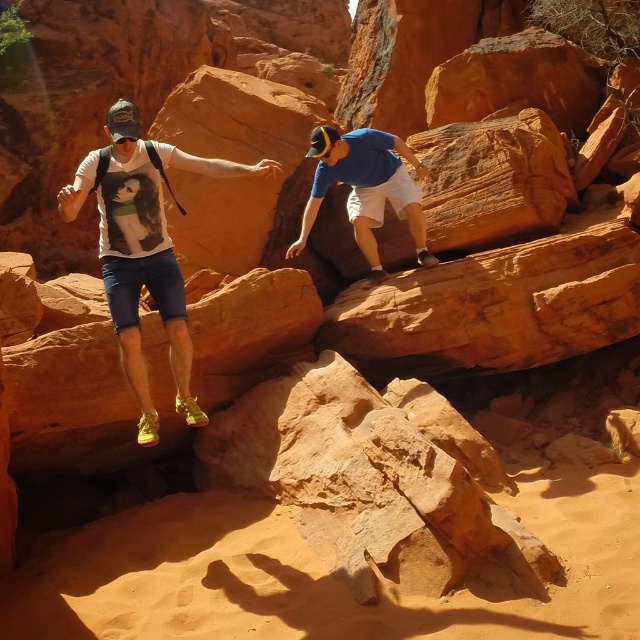
You are a photographer trying to capture the climber in the white T shirt. The camera you are using has a focus point at point (144, 248). Will the focus point land on the climber in the white T shirt?

The matte white t shirt at left is located at point (144, 248), so yes, the focus point will land on the climber in the matte white t shirt at left.

You are a hiker planning to cross the rocky terrain between the two points marked in the image. The first point is at coordinates point (x=67, y=216) and the second is at point (x=374, y=163). Which point should you aim for first to ensure you are moving forward in the direction you are facing?

You should aim for point (x=67, y=216) first because it is in front of point (x=374, y=163), so reaching it first keeps you moving forward in your direction.